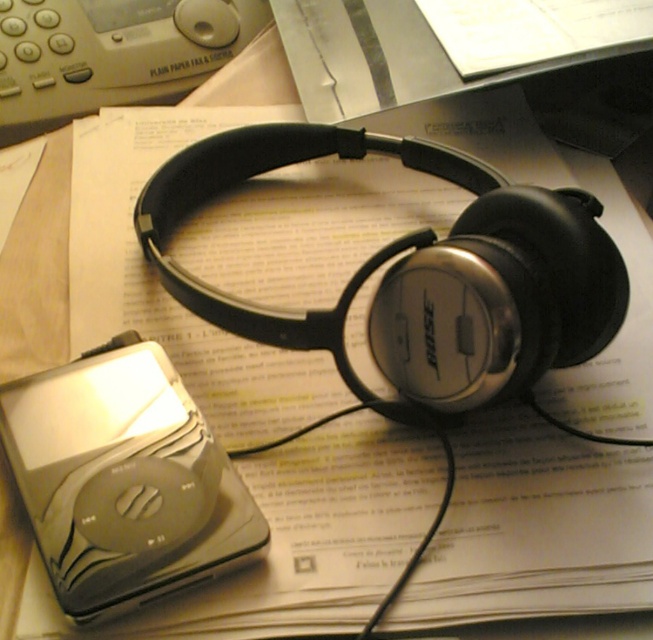
Question: Is satin silver headphones at center further to camera compared to satin silver ipod at center?

Choices:
 (A) yes
 (B) no

Answer: (A)

Question: Is satin silver headphones at center positioned at the back of satin silver ipod at center?

Choices:
 (A) yes
 (B) no

Answer: (A)

Question: Which point is closer to the camera?

Choices:
 (A) satin silver headphones at center
 (B) satin silver ipod at center

Answer: (B)

Question: In this image, where is satin silver headphones at center located relative to satin silver ipod at center?

Choices:
 (A) below
 (B) above

Answer: (B)

Question: Which point appears closest to the camera in this image?

Choices:
 (A) [x=56, y=541]
 (B) [x=511, y=252]

Answer: (A)

Question: Which of the following is the farthest from the observer?

Choices:
 (A) satin silver ipod at center
 (B) satin silver headphones at center

Answer: (B)